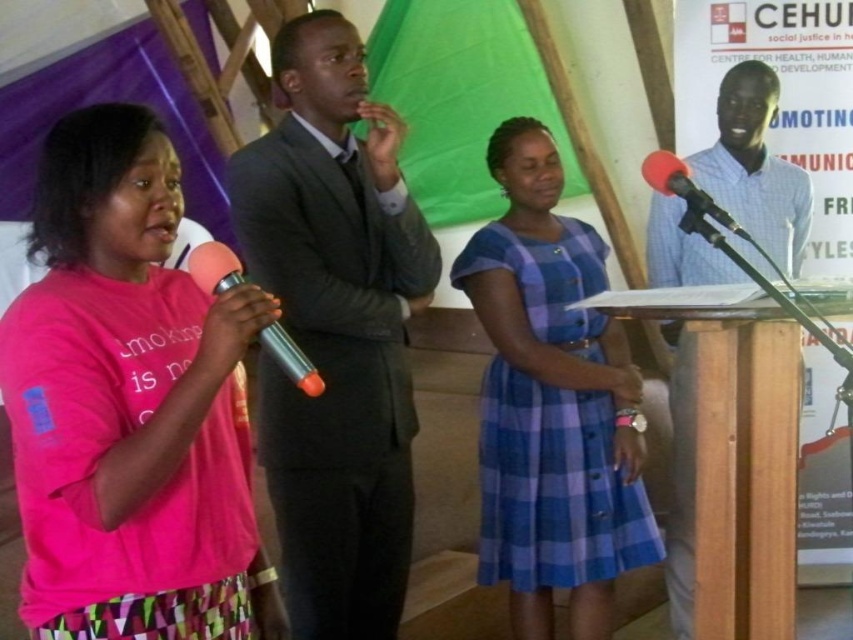
Where is `dark gray suit at center`? The image size is (853, 640). dark gray suit at center is located at coordinates [335, 330].

Does dark gray suit at center have a greater height compared to blue checkered shirt at center?

Incorrect, dark gray suit at center's height is not larger of blue checkered shirt at center's.

Measure the distance between point (387, 202) and camera.

Point (387, 202) is 6.05 feet away from camera.

This screenshot has width=853, height=640. I want to click on dark gray suit at center, so click(x=335, y=330).

Is pink fabric shirt at left wider than blue checkered shirt at center?

No, pink fabric shirt at left is not wider than blue checkered shirt at center.

Which is in front, point (149, 385) or point (668, 588)?

Point (149, 385) is more forward.

Is point (148, 525) in front of point (676, 250)?

Yes, point (148, 525) is in front of point (676, 250).

The width and height of the screenshot is (853, 640). I want to click on pink fabric shirt at left, so click(x=129, y=404).

Which of these two, dark gray suit at center or pink metallic microphone at left, stands taller?

dark gray suit at center is taller.

Can you confirm if dark gray suit at center is shorter than pink metallic microphone at left?

Incorrect, dark gray suit at center's height does not fall short of pink metallic microphone at left's.

This screenshot has width=853, height=640. I want to click on dark gray suit at center, so click(x=335, y=330).